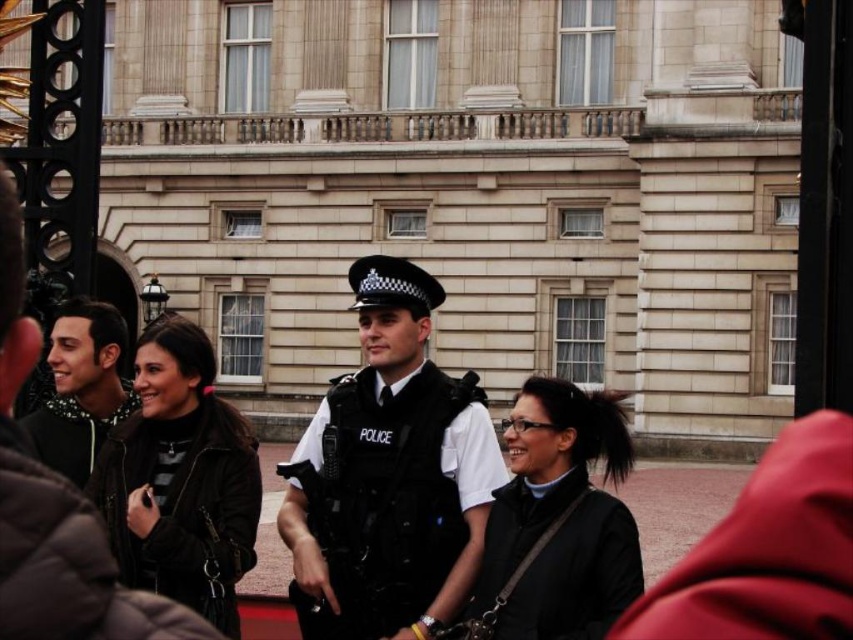
Question: Is beige stone building at center below matte black jacket at left?

Choices:
 (A) no
 (B) yes

Answer: (A)

Question: Which object is the farthest from the beige stone building at center?

Choices:
 (A) black uniformed police officer at center
 (B) matte black jacket at left

Answer: (B)

Question: Does beige stone building at center appear over black uniformed police officer at center?

Choices:
 (A) no
 (B) yes

Answer: (B)

Question: From the image, what is the correct spatial relationship of black uniformed police officer at center in relation to matte black jacket at left?

Choices:
 (A) left
 (B) right

Answer: (B)

Question: Which point appears closest to the camera in this image?

Choices:
 (A) (132, 33)
 (B) (347, 600)
 (C) (96, 326)

Answer: (B)

Question: Which point is closer to the camera?

Choices:
 (A) matte black jacket at left
 (B) black uniformed police officer at center

Answer: (B)